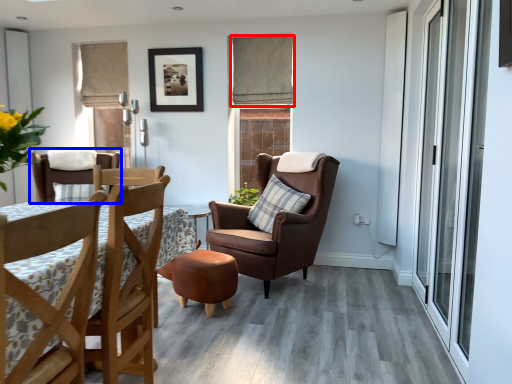
Question: Which of the following is the farthest to the observer, curtain (highlighted by a red box) or chair (highlighted by a blue box)?

Choices:
 (A) curtain
 (B) chair

Answer: (A)